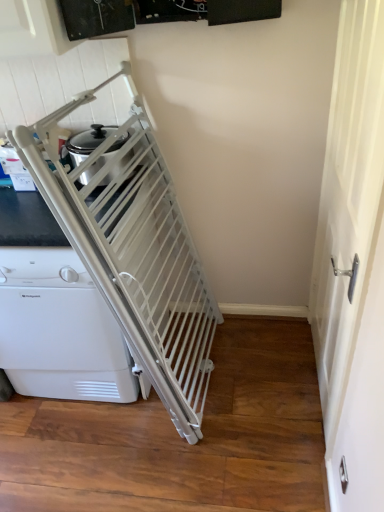
Question: Is white matte screen door at right in front of or behind white plastic gate at left in the image?

Choices:
 (A) behind
 (B) front

Answer: (B)

Question: In the image, is white matte screen door at right on the left side or the right side of white plastic gate at left?

Choices:
 (A) right
 (B) left

Answer: (A)

Question: From the image's perspective, is white matte screen door at right above or below white plastic gate at left?

Choices:
 (A) below
 (B) above

Answer: (B)

Question: Is point (41, 361) positioned closer to the camera than point (369, 209)?

Choices:
 (A) closer
 (B) farther

Answer: (B)

Question: From their relative heights in the image, would you say white plastic gate at left is taller or shorter than white matte screen door at right?

Choices:
 (A) short
 (B) tall

Answer: (A)

Question: Is white plastic gate at left to the left or to the right of white matte screen door at right in the image?

Choices:
 (A) left
 (B) right

Answer: (A)

Question: From the image's perspective, is white plastic gate at left positioned above or below white matte screen door at right?

Choices:
 (A) below
 (B) above

Answer: (A)